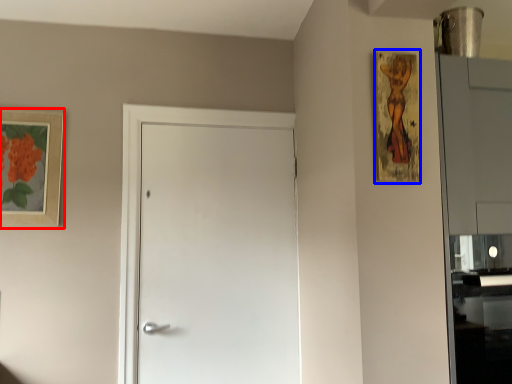
Question: Which of the following is the farthest to the observer, picture frame (highlighted by a red box) or picture frame (highlighted by a blue box)?

Choices:
 (A) picture frame
 (B) picture frame

Answer: (A)